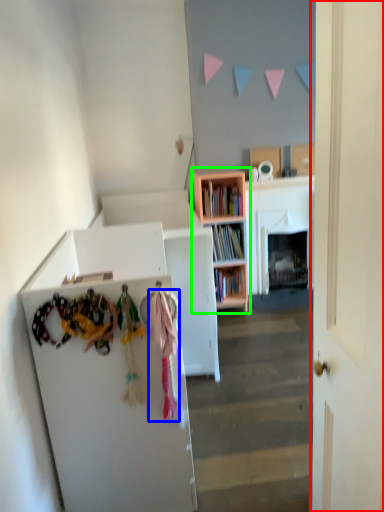
Question: Based on their relative distances, which object is farther from door (highlighted by a red box)? Choose from clothing (highlighted by a blue box) and bookcase (highlighted by a green box).

Choices:
 (A) clothing
 (B) bookcase

Answer: (B)